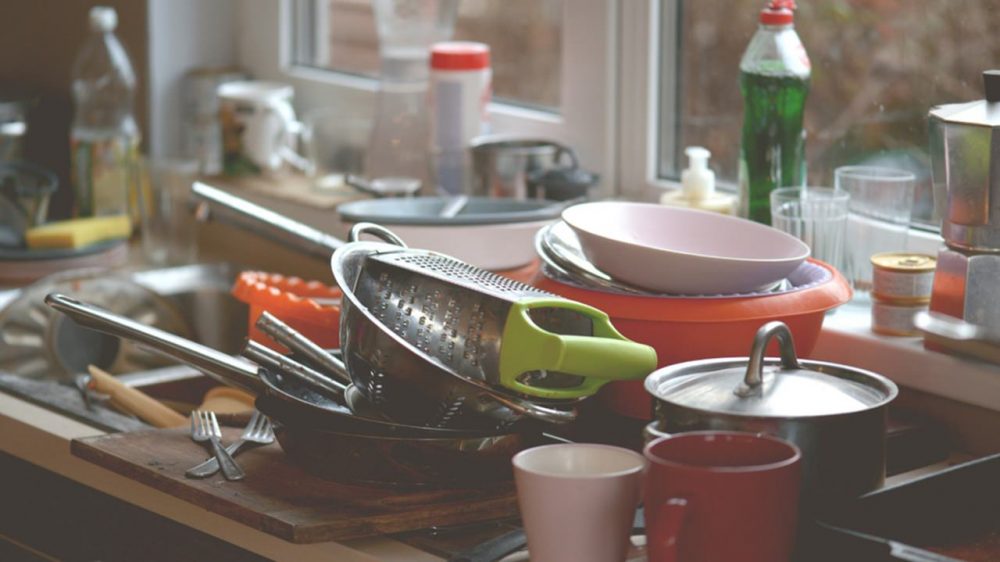
You are a GUI agent. You are given a task and a screenshot of the screen. Output one action in this format:
    pyautogui.click(x=<x>, y=<y>)
    Task: Click on the cup
    The width and height of the screenshot is (1000, 562).
    Given the screenshot: What is the action you would take?
    pyautogui.click(x=565, y=498), pyautogui.click(x=744, y=516), pyautogui.click(x=816, y=223), pyautogui.click(x=883, y=207), pyautogui.click(x=168, y=214), pyautogui.click(x=391, y=143), pyautogui.click(x=320, y=158), pyautogui.click(x=249, y=128), pyautogui.click(x=516, y=170)